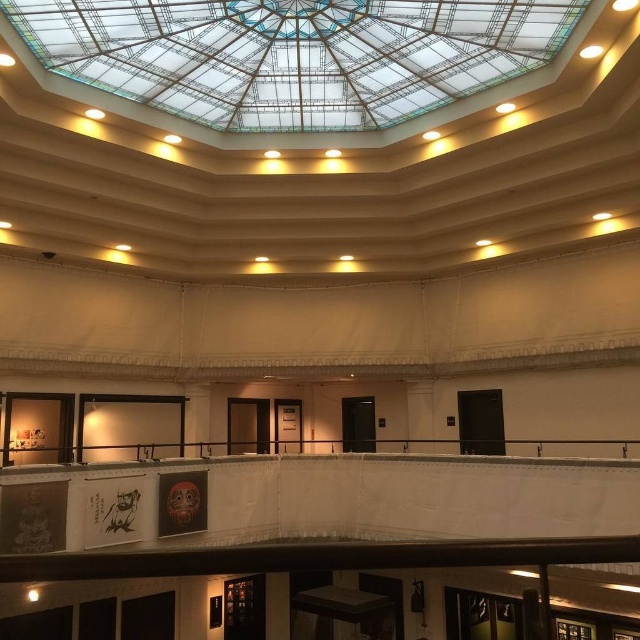
You are an architect analyzing the building structure. You notice the transparent glass ceiling at upper center and the black metal rail at center. Which object is closer to the floor?

The black metal rail at center is closer to the floor because it is shorter than the transparent glass ceiling at upper center.